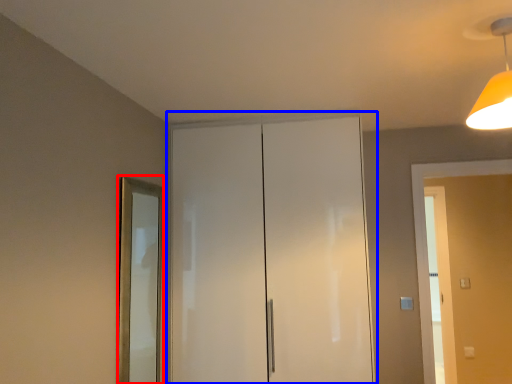
Question: Which object appears closest to the camera in this image, mirror (highlighted by a red box) or dresser (highlighted by a blue box)?

Choices:
 (A) mirror
 (B) dresser

Answer: (A)